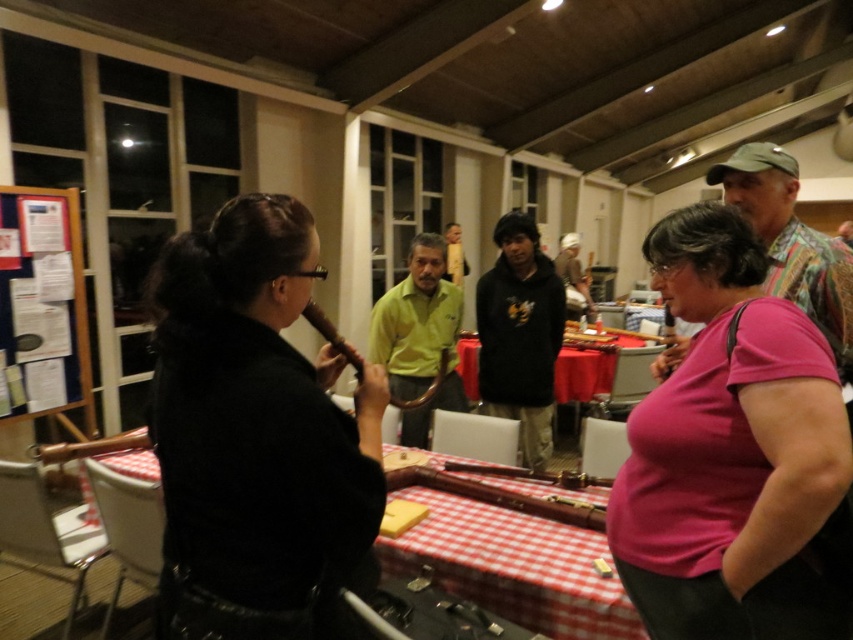
The width and height of the screenshot is (853, 640). I want to click on red checkered tablecloth at center, so click(x=520, y=564).

Identify the location of red checkered tablecloth at center. (520, 564).

Who is taller, yellow matte shirt at center or brown wood flute at center?

With more height is yellow matte shirt at center.

Find the location of a particular element. The width and height of the screenshot is (853, 640). yellow matte shirt at center is located at coordinates (419, 337).

Identify the location of yellow matte shirt at center. Image resolution: width=853 pixels, height=640 pixels. pyautogui.click(x=419, y=337).

Which of these two, red checkered tablecloth at center or yellow matte shirt at center, stands shorter?

red checkered tablecloth at center is shorter.

Who is positioned more to the right, red checkered tablecloth at center or yellow matte shirt at center?

red checkered tablecloth at center

Where is `red checkered tablecloth at center`? red checkered tablecloth at center is located at coordinates (520, 564).

Locate an element on the screen. Image resolution: width=853 pixels, height=640 pixels. red checkered tablecloth at center is located at coordinates (520, 564).